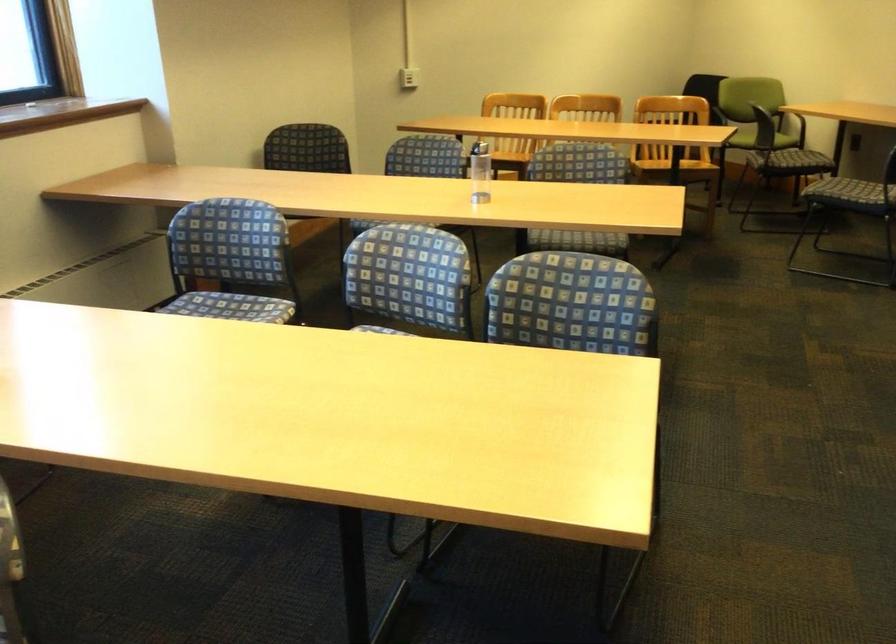
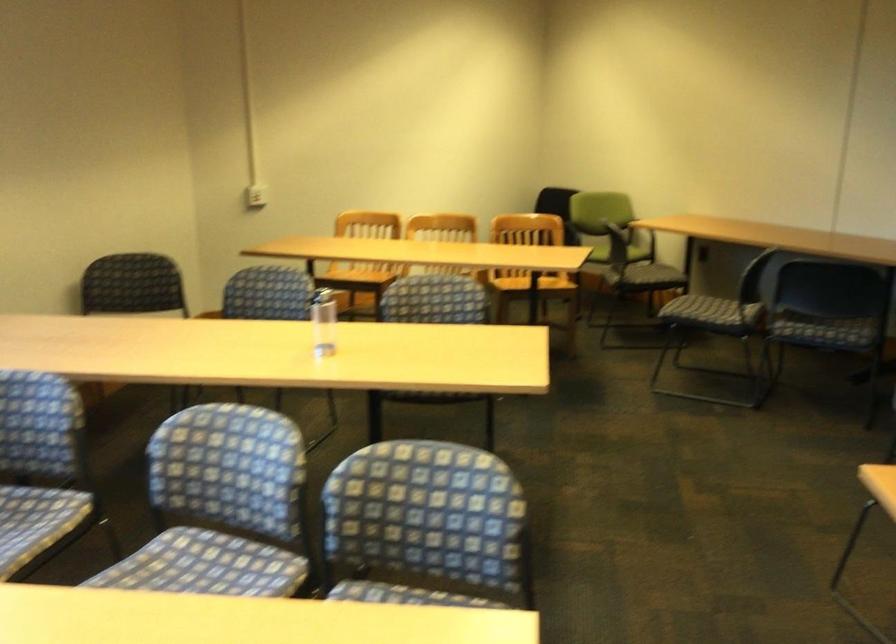
Where in the second image is the point corresponding to the point at 401,305 from the first image?

(221, 506)